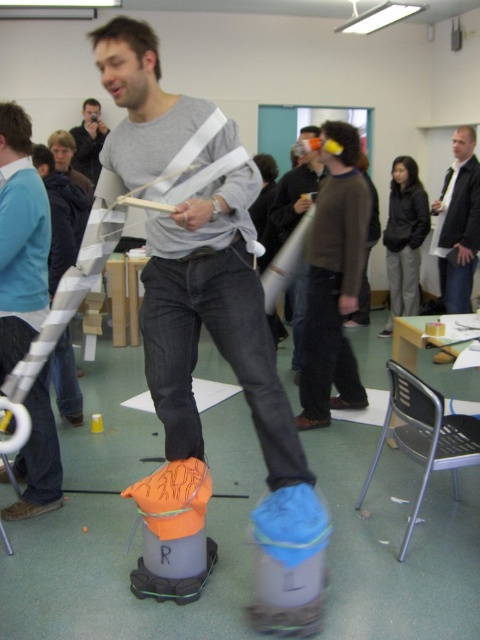
Question: Which object is farther from the camera taking this photo?

Choices:
 (A) matte gray sweater at upper center
 (B) matte orange helmet at upper center
 (C) orange fabric bag at center

Answer: (B)

Question: Which object is the closest to the matte gray sweater at upper center?

Choices:
 (A) orange fabric bag at center
 (B) matte gray shirt at center

Answer: (A)

Question: Observing the image, what is the correct spatial positioning of orange fabric bag at center in reference to matte gray sweater at upper center?

Choices:
 (A) above
 (B) below

Answer: (B)

Question: Can you confirm if matte orange helmet at upper center is positioned below matte gray shirt at center?

Choices:
 (A) no
 (B) yes

Answer: (B)

Question: Can you confirm if orange fabric bag at center is positioned below dark gray jacket at upper right?

Choices:
 (A) yes
 (B) no

Answer: (A)

Question: Among these objects, which one is nearest to the camera?

Choices:
 (A) orange fabric bag at center
 (B) matte orange helmet at upper center
 (C) matte gray shirt at center

Answer: (A)